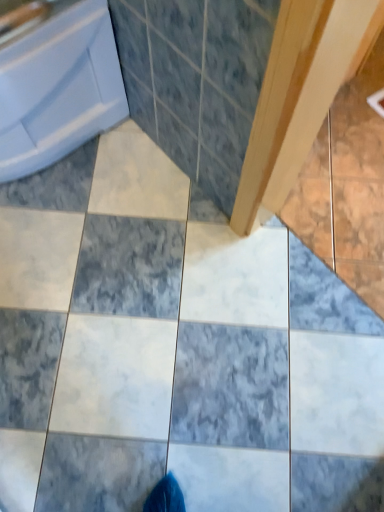
In order to click on blue glossy bathtub at upper left in this screenshot , I will do `click(58, 88)`.

What is the approximate width of blue glossy bathtub at upper left?

blue glossy bathtub at upper left is 30.87 inches wide.

What do you see at coordinates (58, 88) in the screenshot? I see `blue glossy bathtub at upper left` at bounding box center [58, 88].

Find the location of a particular element. Image resolution: width=384 pixels, height=512 pixels. blue glossy bathtub at upper left is located at coordinates (58, 88).